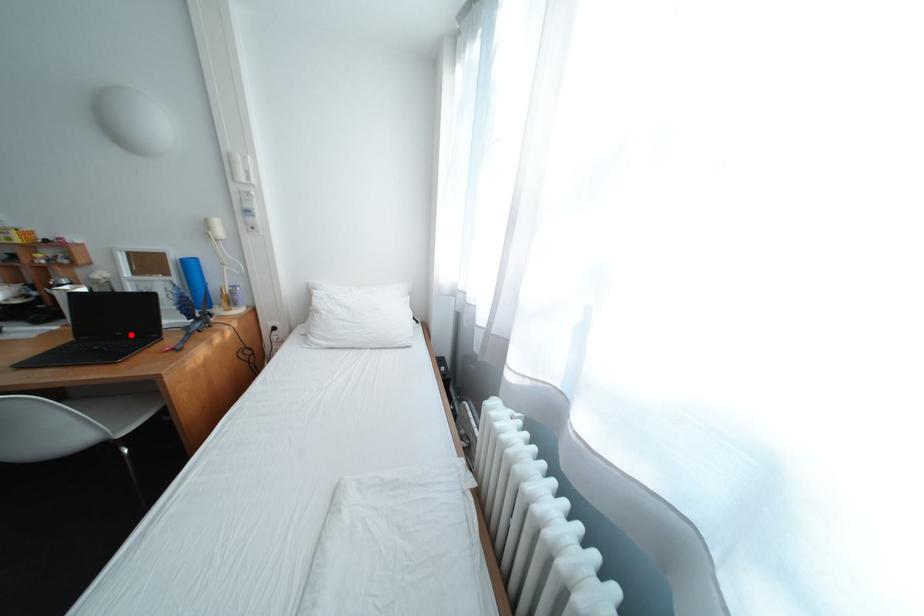
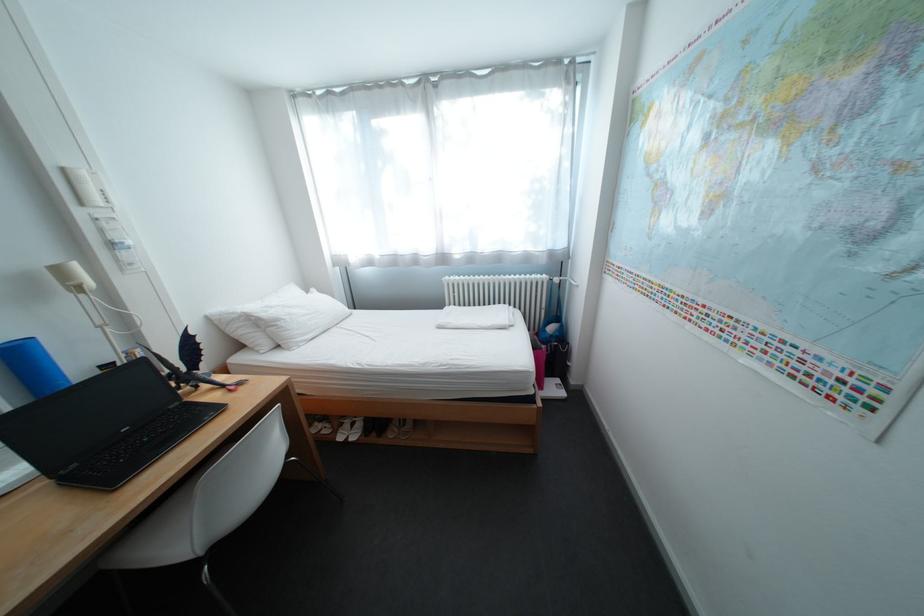
Where in the second image is the point corresponding to the highlighted location from the first image?

(137, 431)